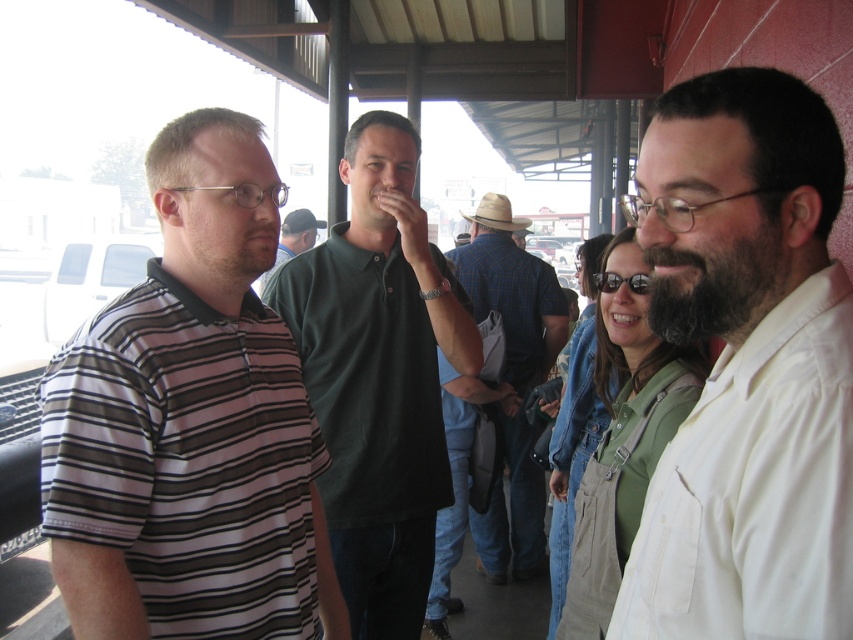
Question: Observing the image, what is the correct spatial positioning of dark green polo shirt at center in reference to green denim overalls at center?

Choices:
 (A) right
 (B) left

Answer: (B)

Question: Can you confirm if blue plaid shirt at center is wider than dark green shirt at center?

Choices:
 (A) yes
 (B) no

Answer: (A)

Question: Estimate the real-world distances between objects in this image. Which object is closer to the blue plaid shirt at center?

Choices:
 (A) striped cotton shirt at left
 (B) dark green polo shirt at center

Answer: (B)

Question: Considering the real-world distances, which object is closest to the blue plaid shirt at center?

Choices:
 (A) denim overalls at center
 (B) dark green shirt at center
 (C) white cotton shirt at center
 (D) striped cotton shirt at left

Answer: (A)

Question: Which object appears closest to the camera in this image?

Choices:
 (A) denim overalls at center
 (B) green denim overalls at center
 (C) striped cotton shirt at left
 (D) white cotton shirt at center

Answer: (D)

Question: In this image, where is white cotton shirt at center located relative to denim overalls at center?

Choices:
 (A) below
 (B) above

Answer: (B)